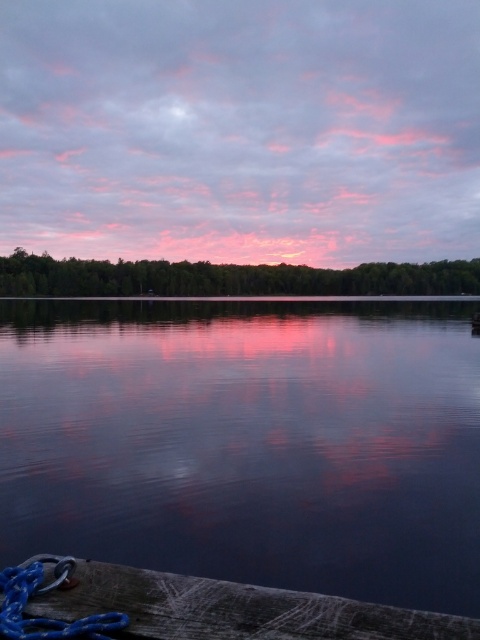
You are standing at the edge of the lake and notice the smooth water at center and the blue rubber rope at lower left. Which object is closer to the horizon?

The smooth water at center is closer to the horizon because it is positioned above the blue rubber rope at lower left, meaning it is farther away from the observer and thus nearer to the horizon.